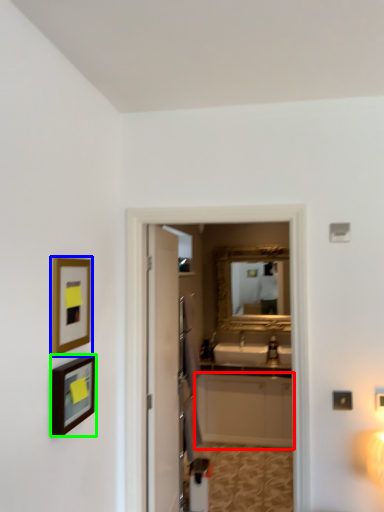
Question: Which object is positioned farthest from cabinetry (highlighted by a red box)? Select from picture frame (highlighted by a blue box) and picture frame (highlighted by a green box).

Choices:
 (A) picture frame
 (B) picture frame

Answer: (A)